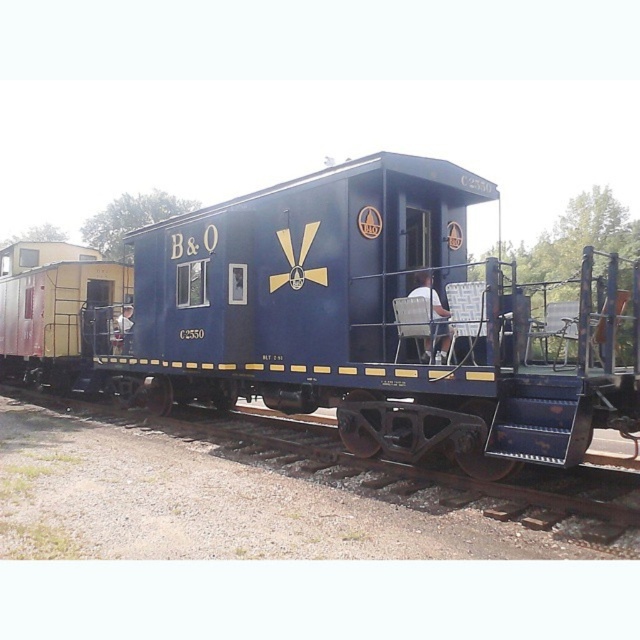
Question: Does matte blue caboose at center have a smaller size compared to white fabric chair at center?

Choices:
 (A) no
 (B) yes

Answer: (A)

Question: Can you confirm if rusty metal track at lower center is smaller than white fabric chair at center?

Choices:
 (A) yes
 (B) no

Answer: (B)

Question: Which of these objects is positioned closest to the rusty metal track at lower center?

Choices:
 (A) white fabric chair at center
 (B) matte blue caboose at center

Answer: (B)

Question: Estimate the real-world distances between objects in this image. Which object is farther from the white fabric chair at center?

Choices:
 (A) rusty metal track at lower center
 (B) matte blue caboose at center

Answer: (B)

Question: Among these points, which one is farthest from the camera?

Choices:
 (A) (516, 499)
 (B) (291, 198)
 (C) (417, 296)

Answer: (B)

Question: Is rusty metal track at lower center smaller than white fabric chair at center?

Choices:
 (A) yes
 (B) no

Answer: (B)